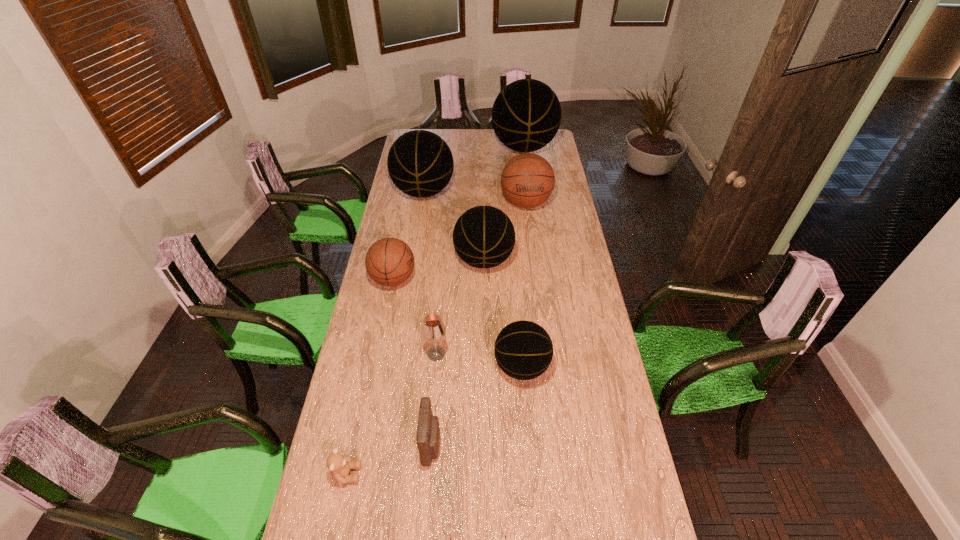
The image size is (960, 540). In the image, there is a desktop. Identify the location of vacant region at the far right corner. (556, 140).

In order to click on vacant region between the nearest black basketball and the tallest basketball in this screenshot , I will do `click(523, 257)`.

Identify the location of unoccupied position between the third farthest black basketball and the third nearest black basketball. (454, 226).

Locate an element on the screen. Image resolution: width=960 pixels, height=540 pixels. vacant region between the wineglass and the pouch is located at coordinates [434, 399].

Identify the location of blank region between the second smallest black basketball and the farthest basketball. (504, 204).

Identify the location of vacant region between the wineglass and the smaller brown basketball. (415, 316).

This screenshot has width=960, height=540. I want to click on free space between the teddy bear and the wineglass, so click(x=392, y=414).

Point out which object is positioned as the seventh nearest to the wineglass. Please provide its 2D coordinates. Your answer should be formatted as a tuple, i.e. [(x, y)], where the tuple contains the x and y coordinates of a point satisfying the conditions above.

[(527, 180)]

Image resolution: width=960 pixels, height=540 pixels. What are the coordinates of `the ninth closest object relative to the tallest object` in the screenshot? It's located at (450, 535).

At what (x,y) coordinates should I click in order to perform the action: click on basketball that is the fourth closest to the ninth tallest object. Please return your answer as a coordinate pair (x, y). Image resolution: width=960 pixels, height=540 pixels. Looking at the image, I should click on (420, 163).